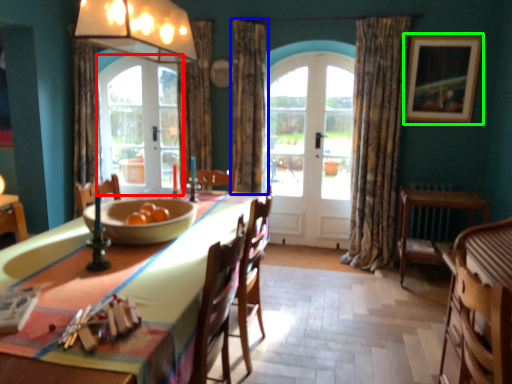
Question: Based on their relative distances, which object is nearer to screen door (highlighted by a red box)? Choose from curtain (highlighted by a blue box) and picture frame (highlighted by a green box).

Choices:
 (A) curtain
 (B) picture frame

Answer: (A)